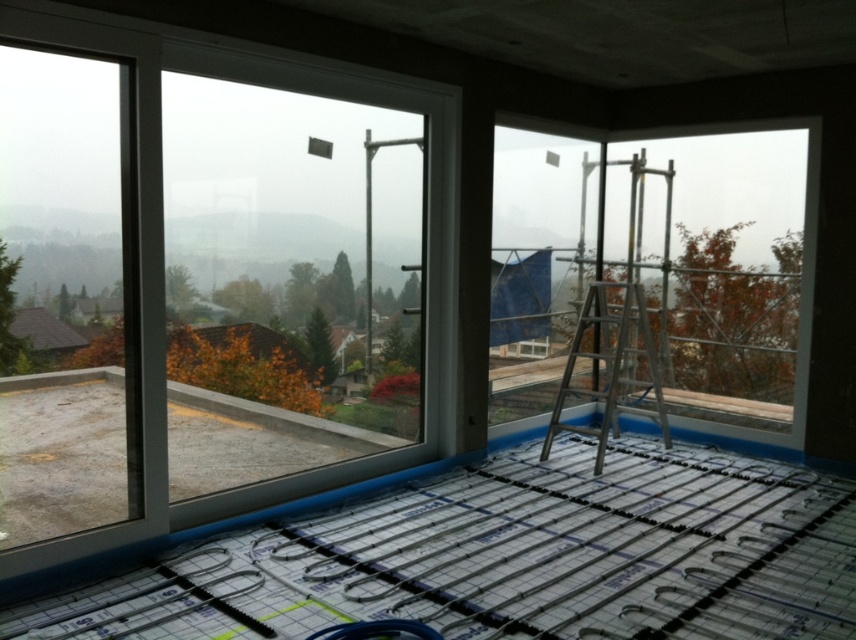
Does transparent glass window at upper left have a lesser width compared to silver metallic ladder at center?

No.

This screenshot has width=856, height=640. What do you see at coordinates (217, 276) in the screenshot? I see `transparent glass window at upper left` at bounding box center [217, 276].

Locate an element on the screen. Image resolution: width=856 pixels, height=640 pixels. transparent glass window at upper left is located at coordinates (217, 276).

This screenshot has height=640, width=856. Identify the location of clear glass window at upper center. pyautogui.click(x=655, y=275).

Who is more distant from viewer, (774, 196) or (633, 320)?

The point (633, 320) is behind.

Measure the distance between clear glass window at upper center and camera.

4.32 meters

Where is `clear glass window at upper center`? clear glass window at upper center is located at coordinates (655, 275).

Between point (421, 257) and point (712, 413), which one is positioned behind?

The point (712, 413) is more distant.

Which of these two, transparent glass window at upper left or clear glass window at upper center, stands taller?

transparent glass window at upper left is taller.

Describe the element at coordinates (217, 276) in the screenshot. I see `transparent glass window at upper left` at that location.

I want to click on transparent glass window at upper left, so click(217, 276).